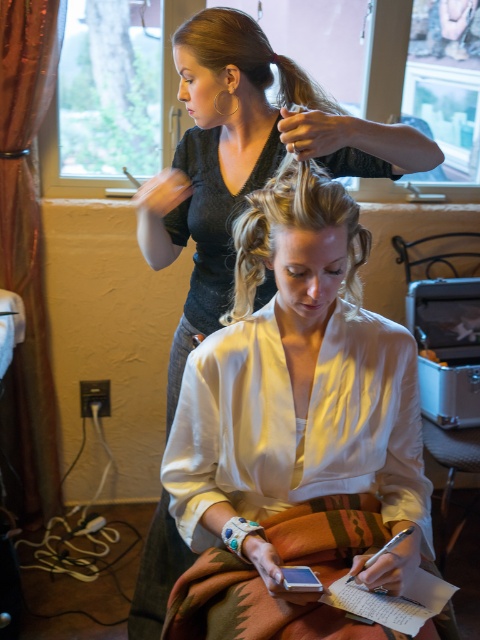
Who is more distant from viewer, (218, 266) or (360, 300)?

Point (360, 300)

Is camouflage fabric robe at center smaller than blonde silky hair at center?

Incorrect, camouflage fabric robe at center is not smaller in size than blonde silky hair at center.

Does point (340, 163) come farther from viewer compared to point (289, 184)?

Yes, point (340, 163) is behind point (289, 184).

The width and height of the screenshot is (480, 640). What are the coordinates of `camouflage fabric robe at center` in the screenshot? It's located at (207, 240).

Based on the photo, is camouflage fabric robe at center positioned in front of blonde hair at upper center?

That is False.

Can you confirm if camouflage fabric robe at center is positioned to the right of blonde hair at upper center?

No, camouflage fabric robe at center is not to the right of blonde hair at upper center.

Locate an element on the screen. This screenshot has height=640, width=480. camouflage fabric robe at center is located at coordinates (207, 240).

Who is taller, blonde silky hair at center or blonde hair at upper center?

blonde silky hair at center

Does point (276, 225) come in front of point (325, 102)?

Yes, point (276, 225) is closer to viewer.

The height and width of the screenshot is (640, 480). In order to click on blonde silky hair at center in this screenshot , I will do `click(294, 227)`.